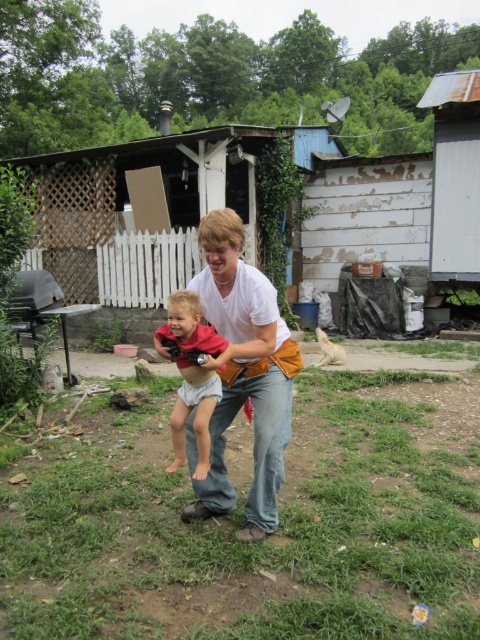
Question: Which object appears farthest from the camera in this image?

Choices:
 (A) light gray cloth diaper at center
 (B) white cotton shirt at center

Answer: (A)

Question: Observing the image, what is the correct spatial positioning of white cotton shirt at center in reference to light gray cloth diaper at center?

Choices:
 (A) right
 (B) left

Answer: (A)

Question: Which point is closer to the camera?

Choices:
 (A) white cotton shirt at center
 (B) light gray cloth diaper at center

Answer: (A)

Question: Where is white cotton shirt at center located in relation to light gray cloth diaper at center in the image?

Choices:
 (A) below
 (B) above

Answer: (B)

Question: Does white cotton shirt at center have a greater width compared to light gray cloth diaper at center?

Choices:
 (A) no
 (B) yes

Answer: (B)